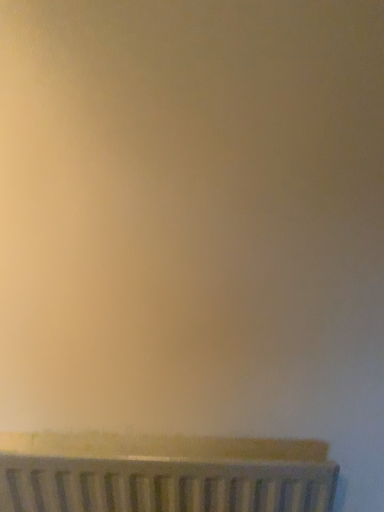
Question: Should I look upward or downward to see white textured radiator at lower center?

Choices:
 (A) down
 (B) up

Answer: (A)